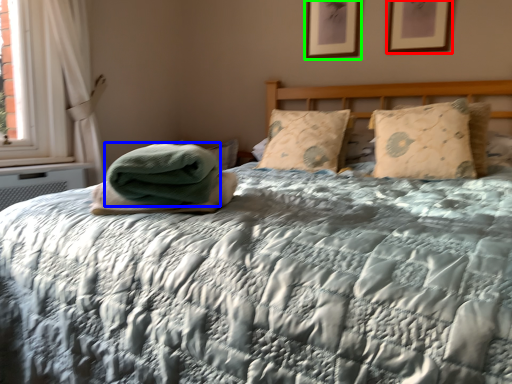
Question: Which object is positioned farthest from picture frame (highlighted by a red box)? Select from material (highlighted by a blue box) and picture frame (highlighted by a green box).

Choices:
 (A) material
 (B) picture frame

Answer: (A)